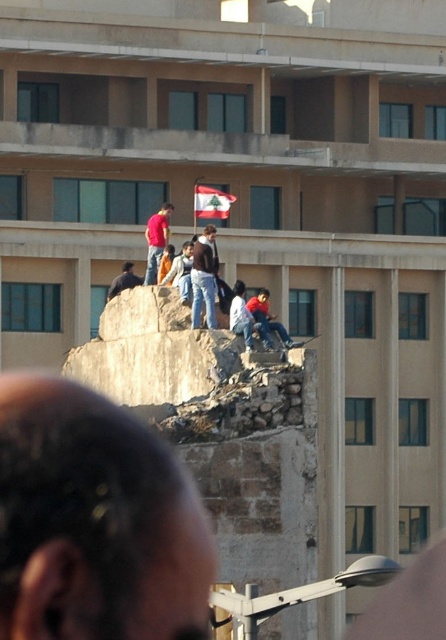
You are a photographer positioned at the origin of the coordinate system. You want to take a photo of the bald head at center. What are the coordinates where you should aim your camera?

The bald head at center is located at coordinates point (94, 522), so you should aim your camera at those coordinates to capture it.

You are a photographer taking a picture of the bald head at center and the white fabric flag at center. Which object should you zoom in on to make them appear the same size in the photo?

Since the bald head at center is larger in size than the white fabric flag at center, you should zoom in on the white fabric flag at center to make them appear the same size in the photo.

You are a photographer positioned on the same structure. You want to capture a wide shot that includes both the matte red shirt at center and the white fabric flag at center in the same frame. Your camera has a maximum focal length that allows capturing objects up to 7 meters apart. Will you be able to include both subjects in the frame?

The distance between the matte red shirt at center and the white fabric flag at center is 7.65 meters. Since the camera can only capture up to 7 meters, you will not be able to include both subjects in the frame.